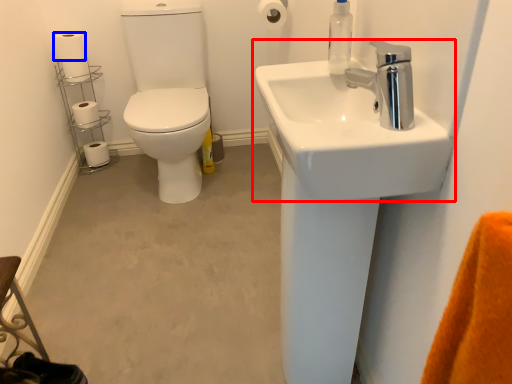
Question: Which object is further to the camera taking this photo, sink (highlighted by a red box) or toilet paper (highlighted by a blue box)?

Choices:
 (A) sink
 (B) toilet paper

Answer: (B)